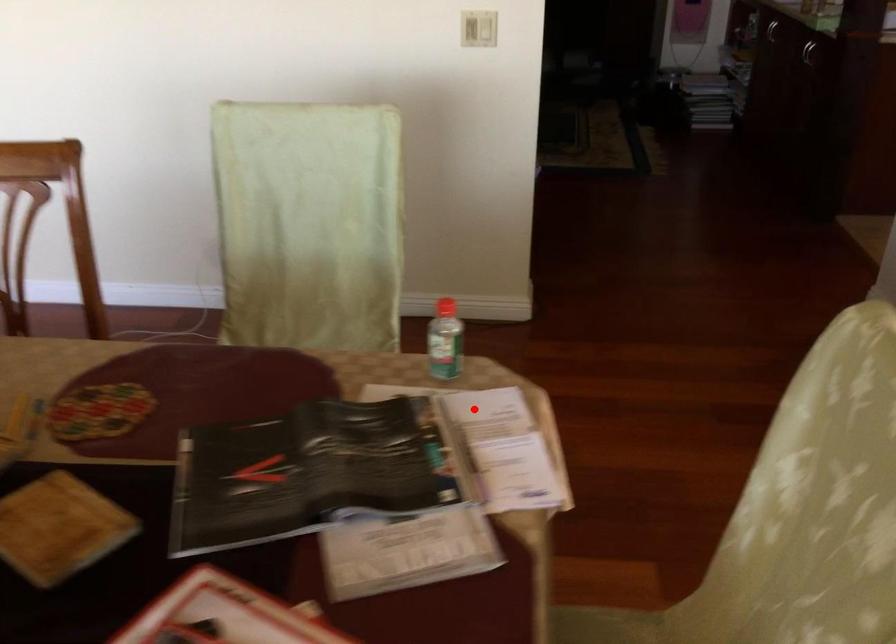
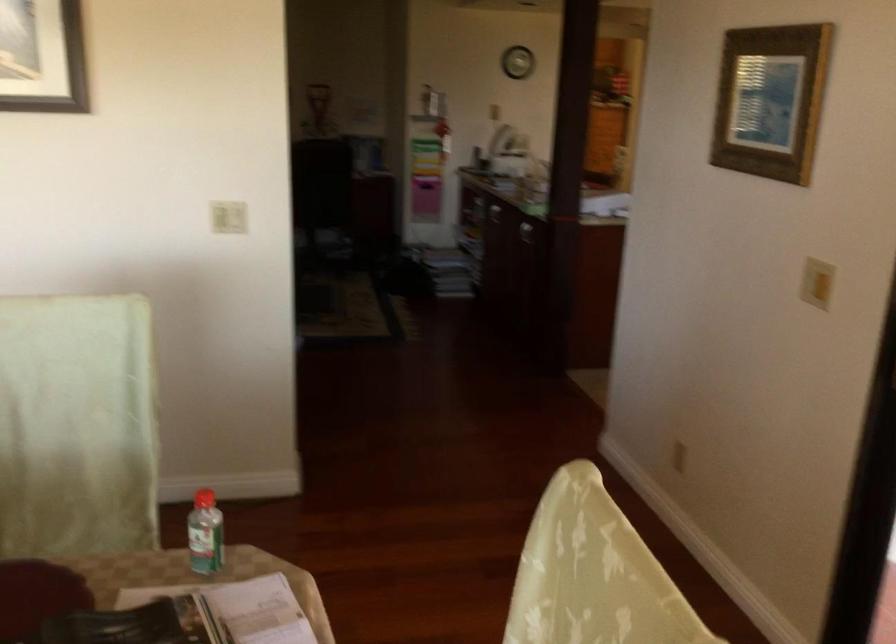
Question: I am providing you with two images of the same scene from different viewpoints. A red point is marked on the first image. Is the red point's position out of view in image 2?

Choices:
 (A) Yes
 (B) No

Answer: (B)